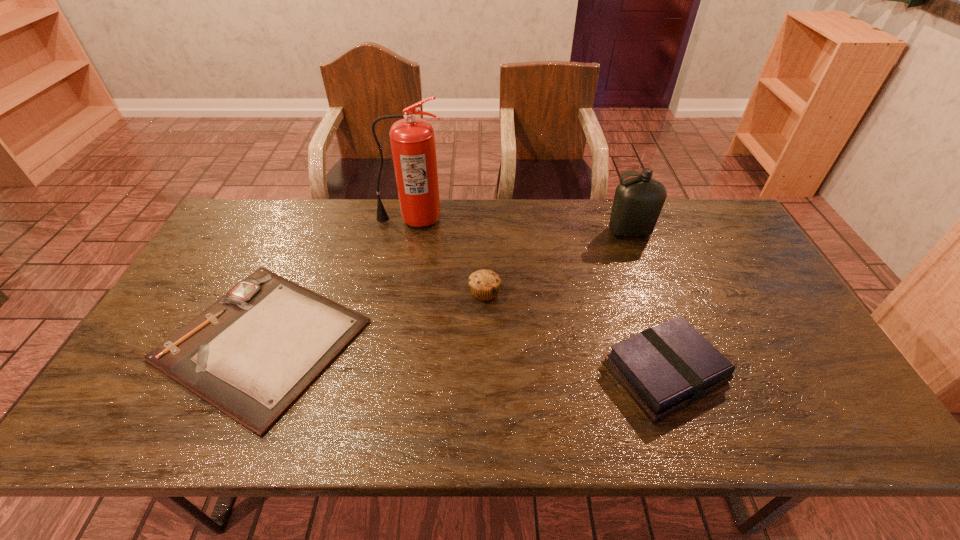
Where is `vacant space that's between the muffin and the bottle`? This screenshot has width=960, height=540. vacant space that's between the muffin and the bottle is located at coordinates (557, 262).

Find the location of a particular element. empty space between the third object from right to left and the second tallest object is located at coordinates (557, 262).

Identify the location of free space between the clipboard and the second tallest object. (445, 286).

Image resolution: width=960 pixels, height=540 pixels. I want to click on free space between the bottle and the fire extinguisher, so click(520, 226).

Locate an element on the screen. vacant space in between the shortest object and the muffin is located at coordinates (373, 316).

Where is `free space that is in between the book and the fire extinguisher`? The width and height of the screenshot is (960, 540). free space that is in between the book and the fire extinguisher is located at coordinates (538, 295).

Locate an element on the screen. This screenshot has height=540, width=960. free spot between the book and the clipboard is located at coordinates (464, 356).

Find the location of a particular element. This screenshot has width=960, height=540. vacant space in between the muffin and the fire extinguisher is located at coordinates (448, 255).

This screenshot has height=540, width=960. What are the coordinates of `blank region between the muffin and the clipboard` in the screenshot? It's located at (373, 316).

The image size is (960, 540). Identify the location of free space between the fire extinguisher and the fourth shortest object. (520, 226).